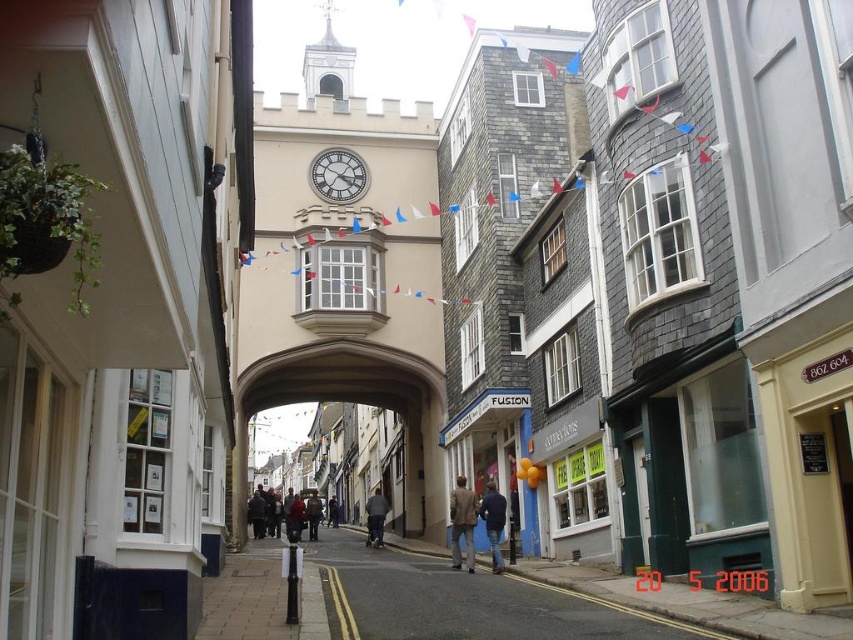
You are a delivery person with a blue denim jacket at center. You need to drive a delivery cart that is 1.5 meters wide through the street. The smooth asphalt road at center is the only path available. Can your cart fit through the road?

The smooth asphalt road at center is wider than the blue denim jacket at center. Since the jacket is likely narrower than the road, and the cart is 1.5 meters wide, if the road is wider than 1.5 meters, the cart can pass. However, without exact measurements, we can infer that since the road is wider than the jacket, and assuming the jacket isn,t excessively narrow, the cart should fit.

You are a delivery person trying to navigate through the street. You see the smooth asphalt road at center and the blue denim jacket at center. Which object is closer to the ground?

The smooth asphalt road at center is below blue denim jacket at center, so the smooth asphalt road at center is closer to the ground.